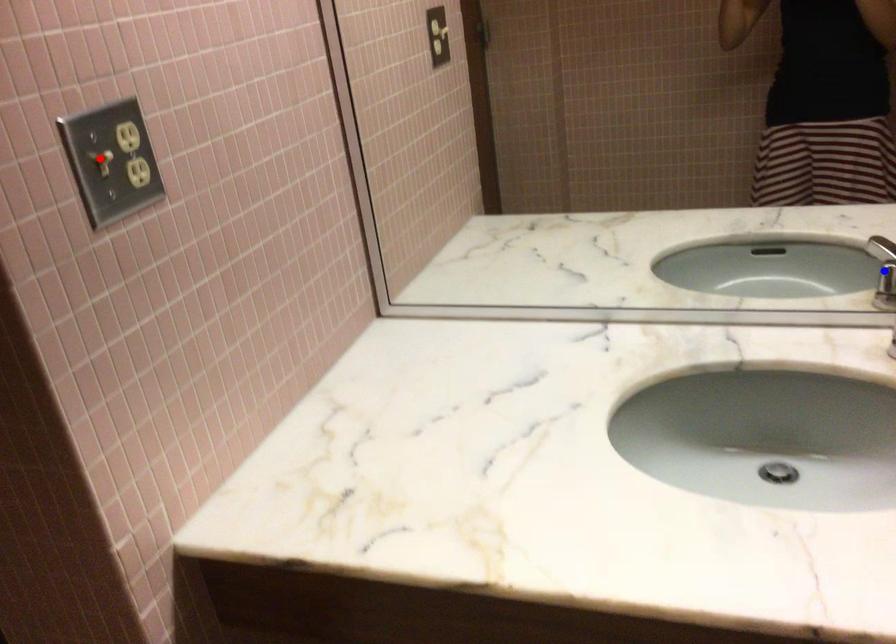
Question: Two points are marked on the image. Which point is closer to the camera?

Choices:
 (A) Blue point is closer.
 (B) Red point is closer.

Answer: (B)